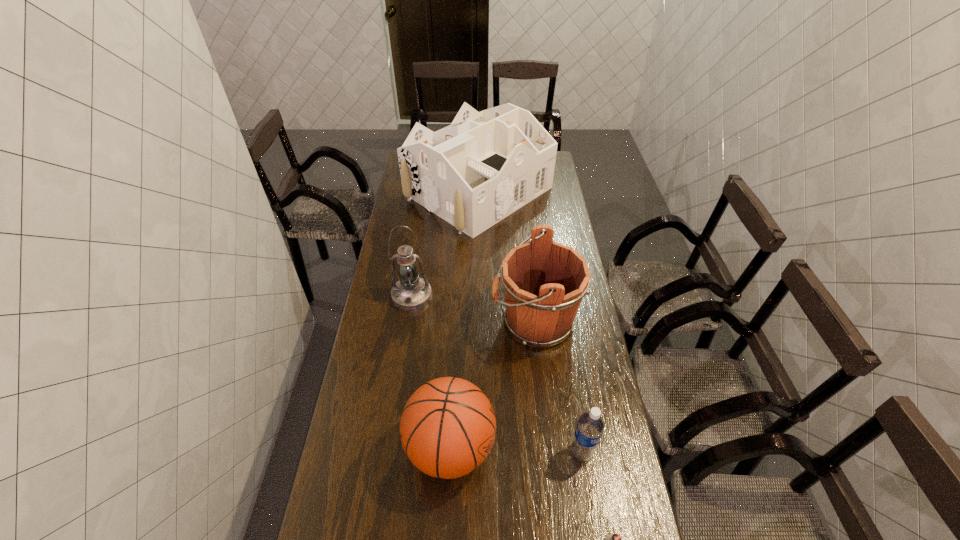
I want to click on vacant region at the left edge of the desktop, so click(x=337, y=472).

At what (x,y) coordinates should I click in order to perform the action: click on vacant space at the right edge. Please return your answer as a coordinate pair (x, y). Looking at the image, I should click on (621, 529).

Locate an element on the screen. The width and height of the screenshot is (960, 540). vacant area between the oil lamp and the water bottle is located at coordinates 496,374.

At what (x,y) coordinates should I click in order to perform the action: click on empty location between the water bottle and the bucket. Please return your answer as a coordinate pair (x, y). This screenshot has height=540, width=960. Looking at the image, I should click on (558, 387).

The image size is (960, 540). I want to click on free space between the oil lamp and the dollhouse, so click(445, 244).

The image size is (960, 540). Identify the location of vacant space that is in between the oil lamp and the water bottle. (496, 374).

Locate an element on the screen. free space between the oil lamp and the bucket is located at coordinates (473, 309).

Locate an element on the screen. This screenshot has height=540, width=960. free spot between the bucket and the water bottle is located at coordinates 558,387.

Identify which object is the nearest to the bucket. Please provide its 2D coordinates. Your answer should be formatted as a tuple, i.e. [(x, y)], where the tuple contains the x and y coordinates of a point satisfying the conditions above.

[(447, 429)]

Find the location of `object that is the fourth closest to the farthest object`. object that is the fourth closest to the farthest object is located at coordinates (590, 426).